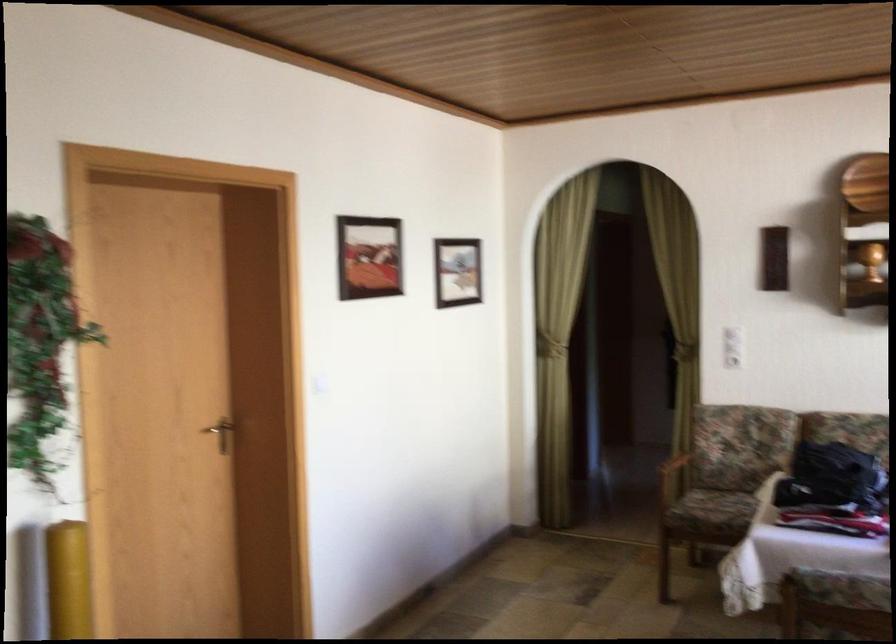
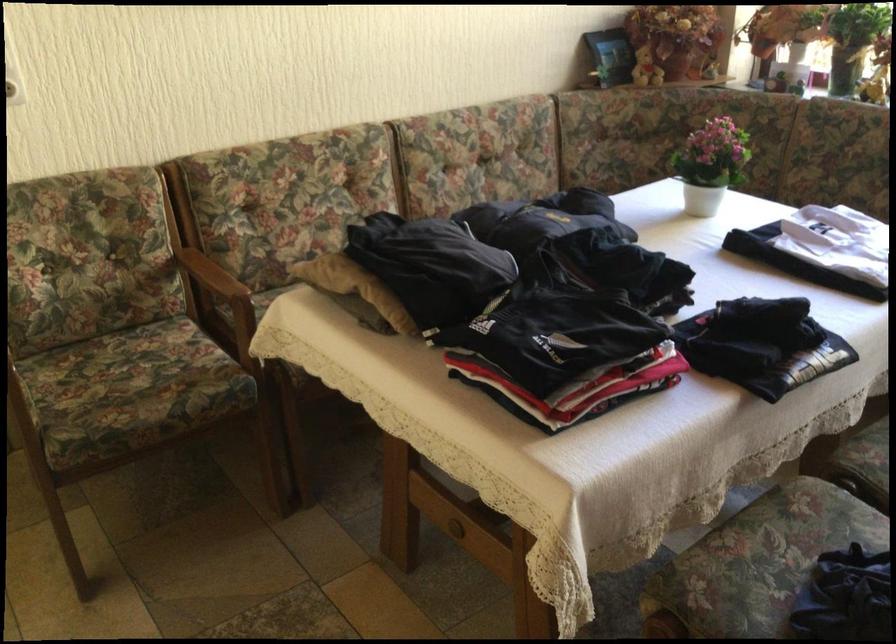
Find the pixel in the second image that matches point 791,462 in the first image.

(355, 287)